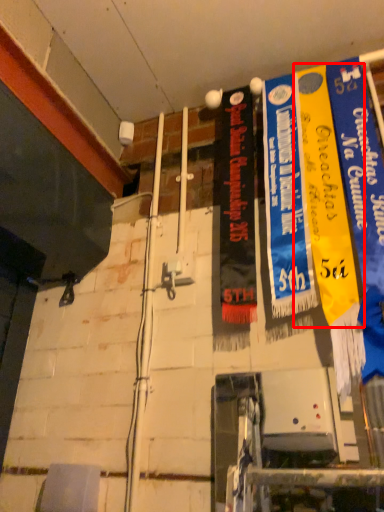
Question: From the image's perspective, what is the correct spatial relationship of poster (annotated by the red box) in relation to poster?

Choices:
 (A) below
 (B) above

Answer: (A)